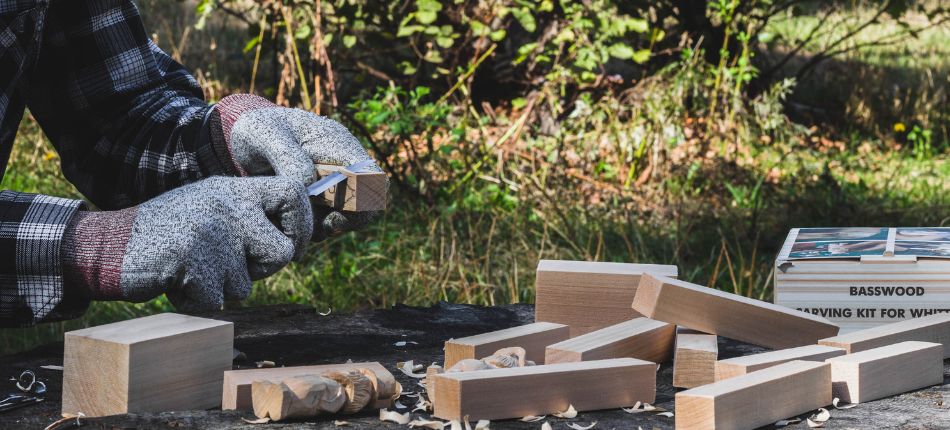
The height and width of the screenshot is (430, 950). Find the location of `cardboard box`. cardboard box is located at coordinates (844, 268).